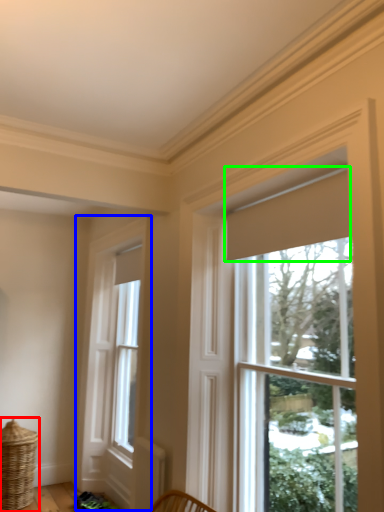
Question: Estimate the real-world distances between objects in this image. Which object is closer to basket (highlighted by a red box), window (highlighted by a blue box) or curtain (highlighted by a green box)?

Choices:
 (A) window
 (B) curtain

Answer: (A)